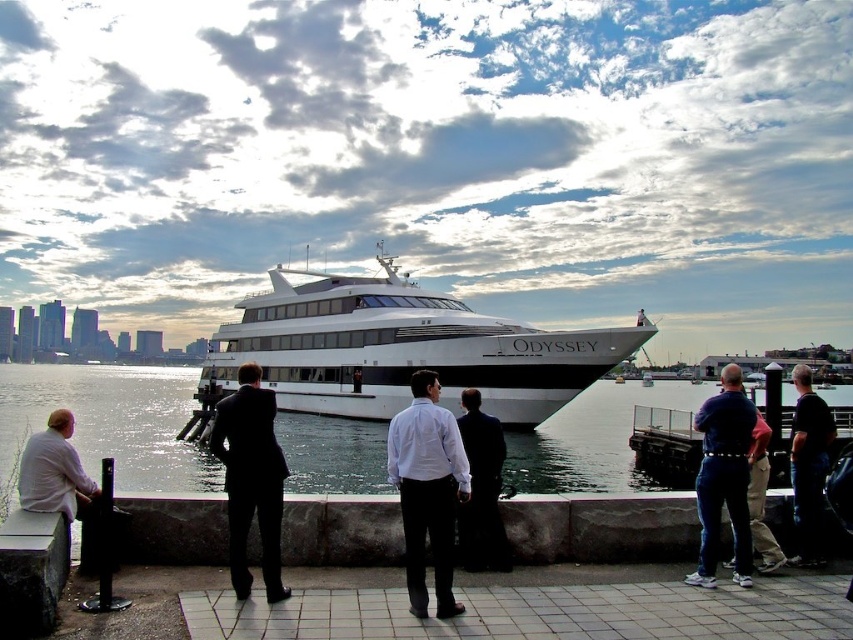
You are standing on the waterfront walkway and want to take a photo of the white glossy cruise ship at center. If your camera has a maximum zoom range of 50 meters, will you be able to capture the ship clearly?

The white glossy cruise ship at center is 70.37 meters away from the viewer. Since the camera can only zoom up to 50 meters, you won the be able to capture the ship clearly.

In the scene shown: You are a photographer trying to capture a group photo of the people at the waterfront. You notice the white smooth shirt at center and the black suit at center. Which of these two items should you adjust in your composition to ensure they are both clearly visible in the frame?

Since the white smooth shirt at center occupies less space than the black suit at center, you should adjust the position of the black suit at center to ensure both are clearly visible in the frame.

From the picture: You are a photographer trying to capture the scene from the water side. You notice the white smooth shirt at center and the black suit at center. Which clothing item is closer to you?

The white smooth shirt at center is positioned over the black suit at center, so the white smooth shirt at center is closer to you.